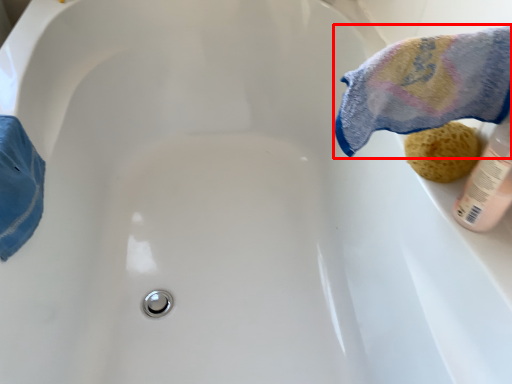
Question: Where is bath towel (annotated by the red box) located in relation to stuff in the image?

Choices:
 (A) left
 (B) right

Answer: (A)